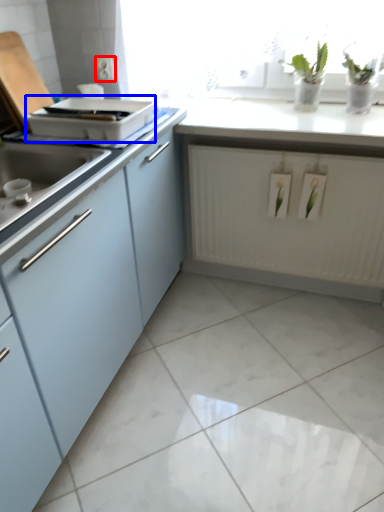
Question: Which point is closer to the camera, electric outlet (highlighted by a red box) or appliance (highlighted by a blue box)?

Choices:
 (A) electric outlet
 (B) appliance

Answer: (B)